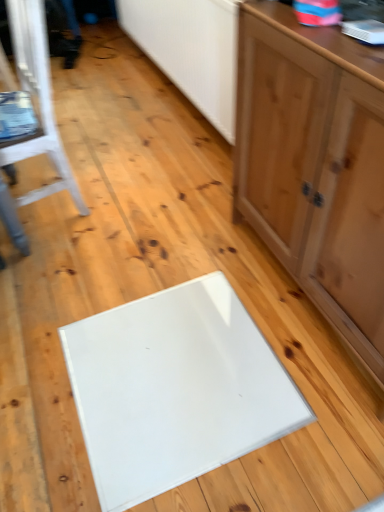
Question: From a real-world perspective, is white painted wood chair at left on top of matte wood cabinet at right?

Choices:
 (A) no
 (B) yes

Answer: (A)

Question: Considering the relative sizes of white painted wood chair at left and matte wood cabinet at right in the image provided, is white painted wood chair at left wider than matte wood cabinet at right?

Choices:
 (A) no
 (B) yes

Answer: (B)

Question: Is white painted wood chair at left bigger than matte wood cabinet at right?

Choices:
 (A) no
 (B) yes

Answer: (A)

Question: Does white painted wood chair at left contain matte wood cabinet at right?

Choices:
 (A) no
 (B) yes

Answer: (A)

Question: Is white painted wood chair at left not close to matte wood cabinet at right?

Choices:
 (A) yes
 (B) no

Answer: (B)

Question: Does white painted wood chair at left have a greater height compared to matte wood cabinet at right?

Choices:
 (A) no
 (B) yes

Answer: (A)

Question: From a real-world perspective, is matte wood cabinet at right positioned over white painted wood chair at left based on gravity?

Choices:
 (A) yes
 (B) no

Answer: (A)

Question: Is matte wood cabinet at right looking in the opposite direction of white painted wood chair at left?

Choices:
 (A) yes
 (B) no

Answer: (B)

Question: Does matte wood cabinet at right appear on the right side of white painted wood chair at left?

Choices:
 (A) yes
 (B) no

Answer: (A)

Question: Does matte wood cabinet at right have a greater width compared to white painted wood chair at left?

Choices:
 (A) no
 (B) yes

Answer: (A)

Question: Is matte wood cabinet at right not within white painted wood chair at left?

Choices:
 (A) no
 (B) yes

Answer: (B)

Question: From the image's perspective, is matte wood cabinet at right located above white painted wood chair at left?

Choices:
 (A) yes
 (B) no

Answer: (B)

Question: From the image's perspective, is matte wood cabinet at right located above or below white painted wood chair at left?

Choices:
 (A) below
 (B) above

Answer: (A)